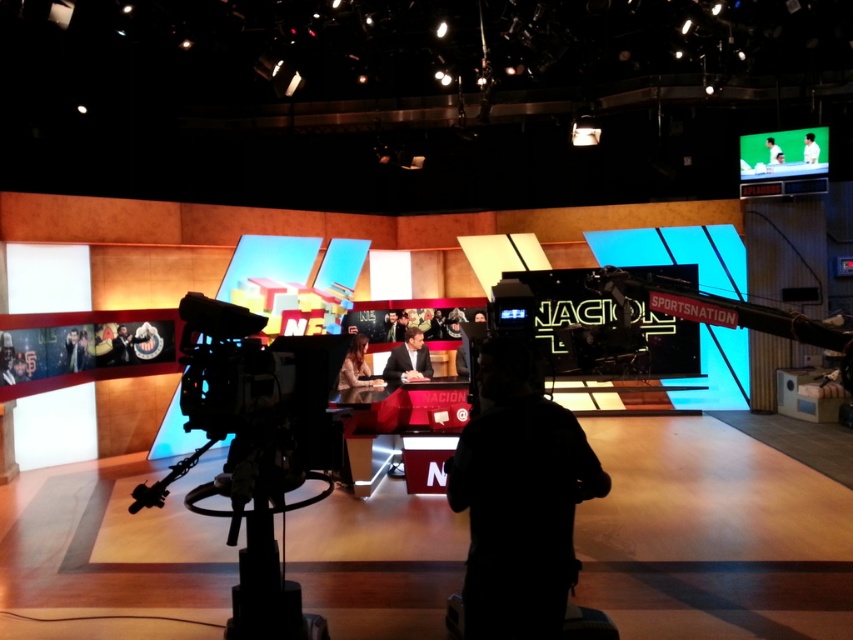
You are a guest speaker in the studio and need to present a slide show. You have a laptop connected to the green matte projection screen at upper right and are wearing a smooth black suit at lower left. Can you position yourself so that your suit does not block the screen during your presentation?

The green matte projection screen at upper right might be wider than the smooth black suit at lower left, so positioning yourself to the side of the screen or ensuring the suit is not in the center should prevent blocking.

You are standing in the TV studio and want to place a small plant between the two points labeled point (283,500) and point (770,150). Which point should the plant be closer to in order to be nearer to the hosts seated at the desk?

The plant should be closer to point (283,500) because it is nearer to the hosts seated at the desk compared to point (770,150).